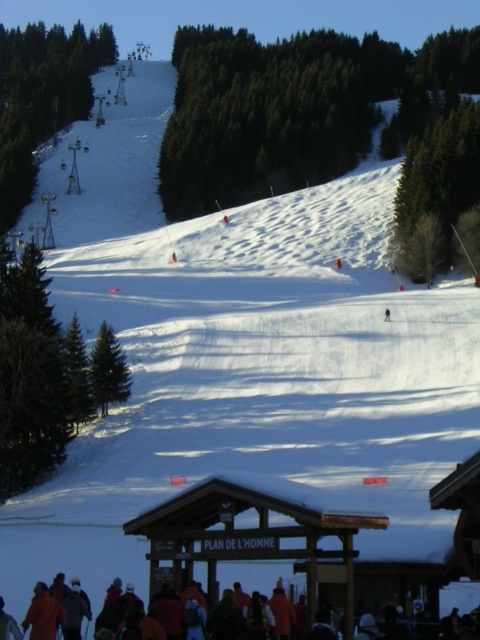
Question: Which is farther from the orange ski jacket at lower left?

Choices:
 (A) orange fabric jacket at lower center
 (B) dark blue jacket at lower left

Answer: (A)

Question: Among these objects, which one is nearest to the camera?

Choices:
 (A) orange fabric jacket at lower center
 (B) orange ski jacket at lower left
 (C) dark blue jacket at lower left

Answer: (C)

Question: Is orange fabric jacket at lower center to the left of dark blue jacket at lower left from the viewer's perspective?

Choices:
 (A) no
 (B) yes

Answer: (A)

Question: Observing the image, what is the correct spatial positioning of orange fabric jacket at lower center in reference to orange ski jacket at lower left?

Choices:
 (A) above
 (B) below

Answer: (B)

Question: Which of the following is the farthest from the observer?

Choices:
 (A) dark blue jacket at lower left
 (B) orange ski jacket at lower left
 (C) orange fabric jacket at lower center

Answer: (C)

Question: Can you confirm if orange ski jacket at lower left is bigger than dark blue jacket at lower left?

Choices:
 (A) yes
 (B) no

Answer: (B)